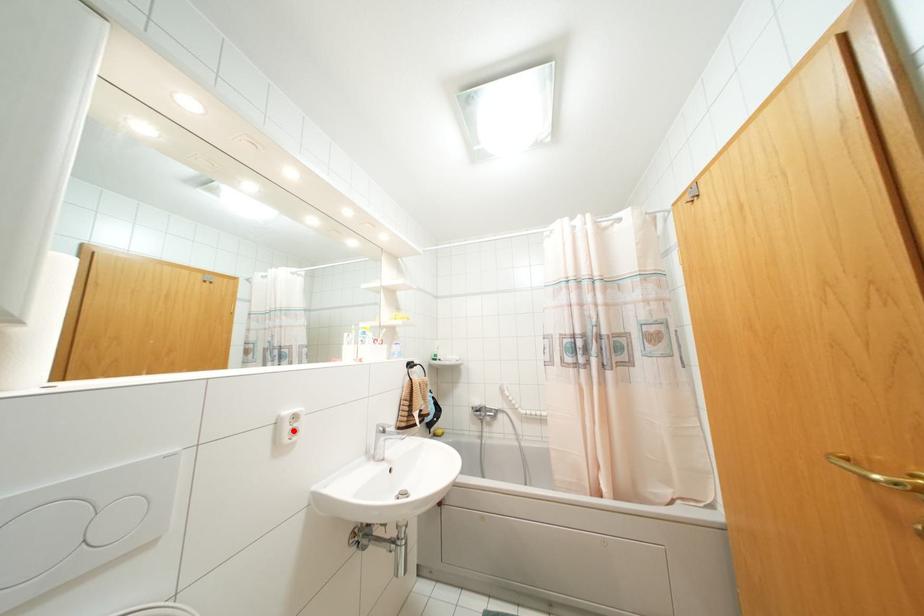
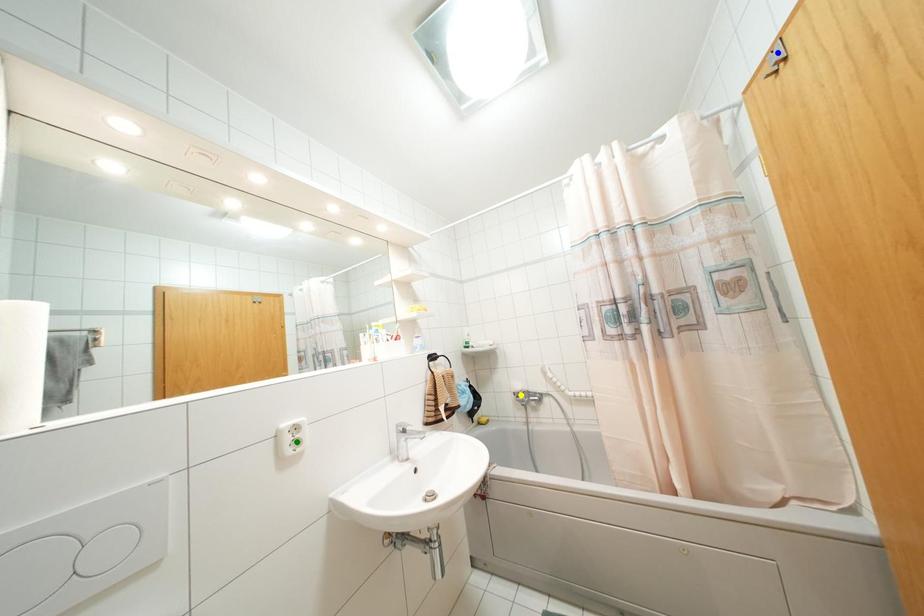
Question: I am providing you with two images of the same scene from different viewpoints. A red point is marked on the first image. You are given multiple points on the second image. Can you choose the point in image 2 that corresponds to the point in image 1?

Choices:
 (A) green point
 (B) blue point
 (C) yellow point

Answer: (A)